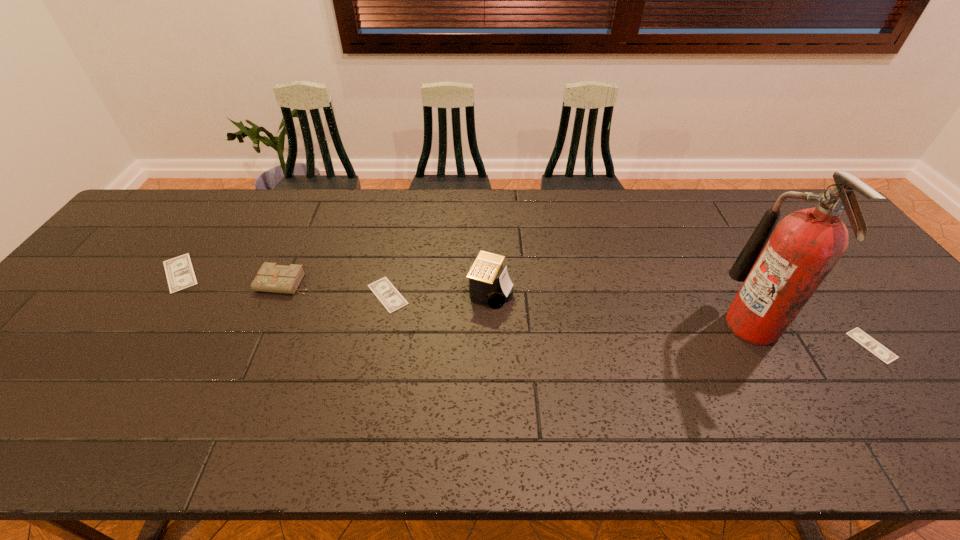
The image size is (960, 540). Find the location of `vacant point that satisfies the following two spatial constraints: 1. on the front side of the third object from right to left; 2. on the left side of the fourth shortest object`. vacant point that satisfies the following two spatial constraints: 1. on the front side of the third object from right to left; 2. on the left side of the fourth shortest object is located at coordinates (281, 292).